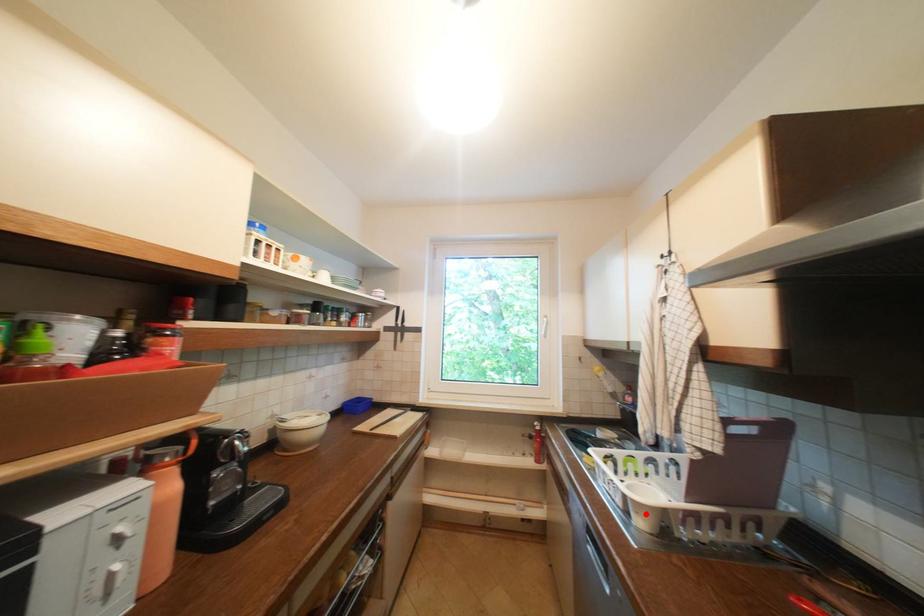
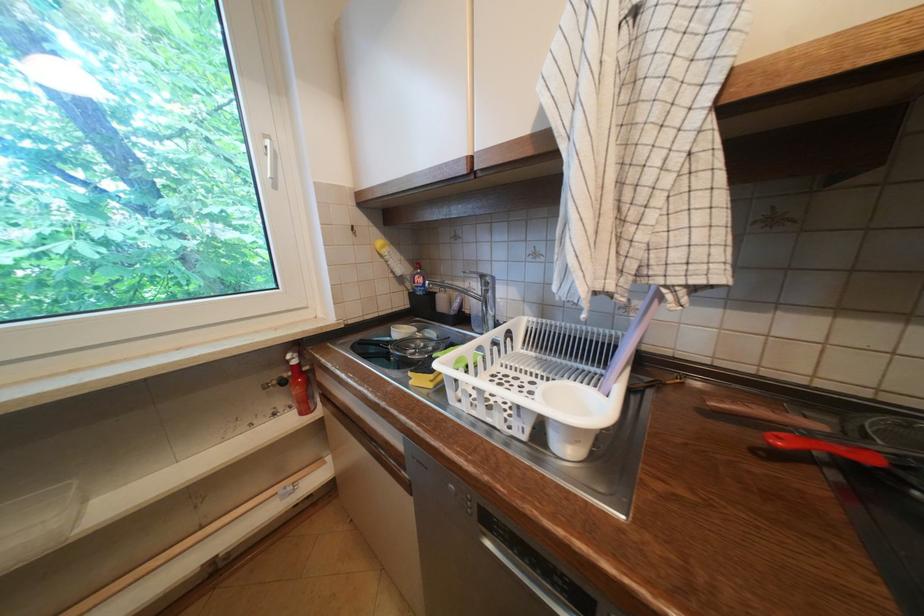
Find the pixel in the second image that matches the highlighted location in the first image.

(586, 443)